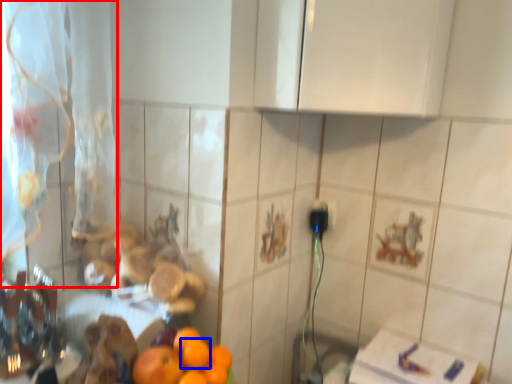
Question: Which object is closer to the camera taking this photo, curtain (highlighted by a red box) or orange (highlighted by a blue box)?

Choices:
 (A) curtain
 (B) orange

Answer: (A)